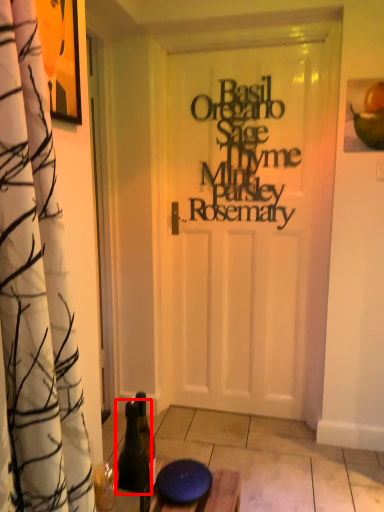
Question: From the image's perspective, where is bottle (annotated by the red box) located relative to writing?

Choices:
 (A) above
 (B) below

Answer: (B)